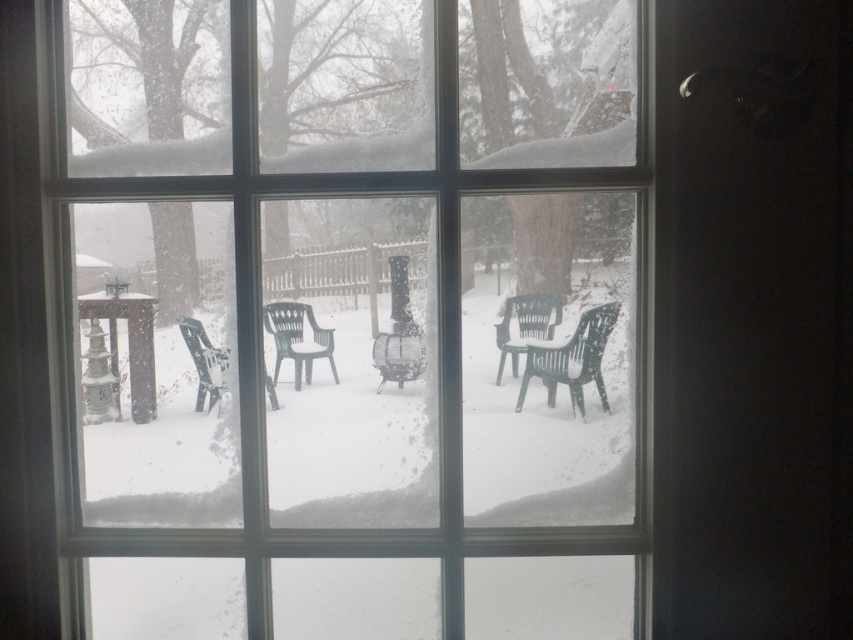
From the picture: You are trying to determine if a small package that is 2 feet wide can fit through the space between the transparent glass window at center and the green plastic chair at lower left. Based on their sizes, can the package fit through that space?

The transparent glass window at center is wider than the green plastic chair at lower left, so the space between them may be sufficient to fit the 2 feet wide package. However, without exact measurements of the gap, it is uncertain. The description only states the window is larger in width than the chair, but not the exact dimensions of the space between them.

You are standing in a room with a multi paned window. You see a point at coordinates (x=354, y=307). What object is located at that point?

The point at coordinates (x=354, y=307) indicates the transparent glass window at center.